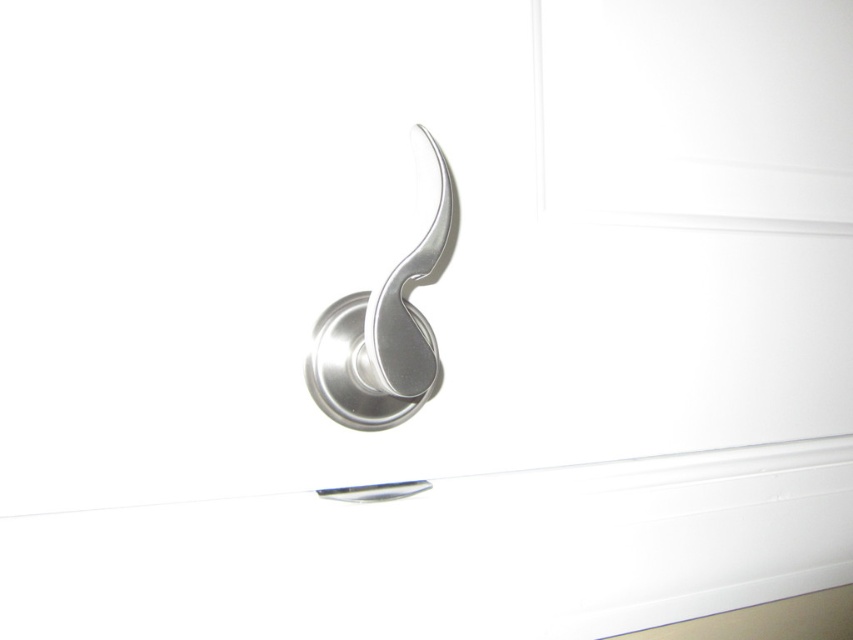
Question: Is satin silver handle at center wider than polished silver door handle at center?

Choices:
 (A) no
 (B) yes

Answer: (B)

Question: Does satin silver handle at center appear over polished silver door handle at center?

Choices:
 (A) yes
 (B) no

Answer: (B)

Question: Which object appears closest to the camera in this image?

Choices:
 (A) satin silver handle at center
 (B) polished silver door handle at center

Answer: (A)

Question: Which point is farther to the camera?

Choices:
 (A) polished silver door handle at center
 (B) satin silver handle at center

Answer: (A)

Question: Does satin silver handle at center appear under polished silver door handle at center?

Choices:
 (A) no
 (B) yes

Answer: (B)